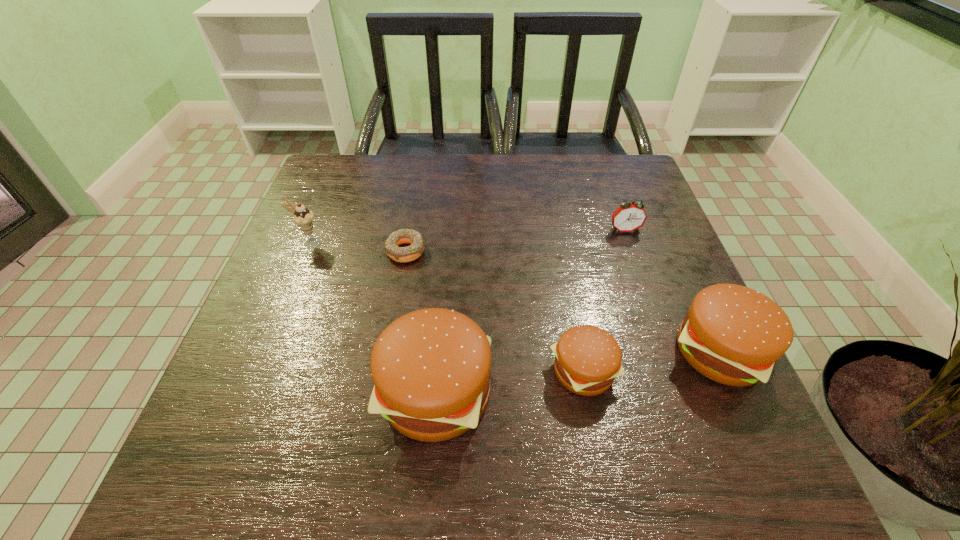
Please point a free position for a hamburger on the left. Please provide its 2D coordinates. Your answer should be formatted as a tuple, i.e. [(x, y)], where the tuple contains the x and y coordinates of a point satisfying the conditions above.

[(277, 416)]